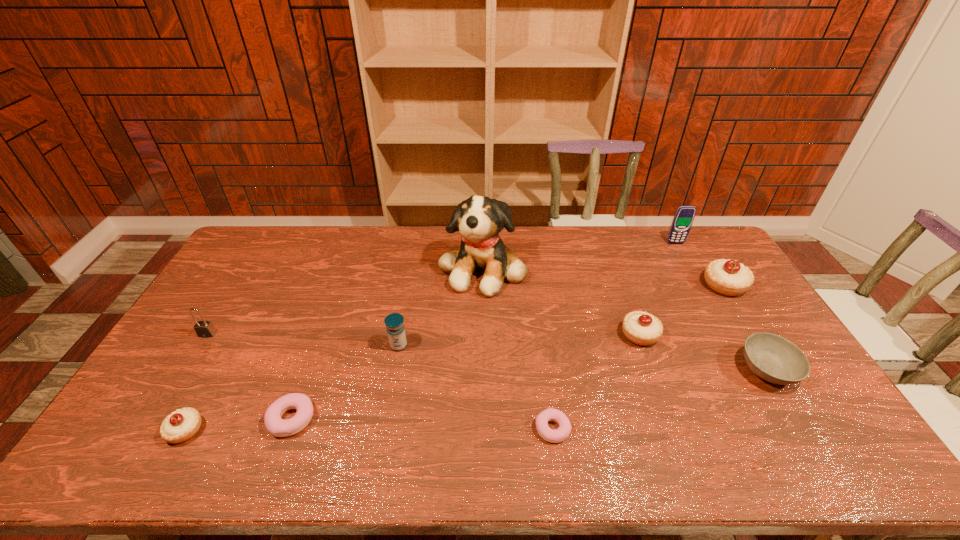
Find the location of a particular element. The image size is (960, 540). vacant region located 0.150m on the shackle of the gray padlock is located at coordinates (180, 379).

Find the location of `vacant space located 0.280m on the left of the blue medicine`. vacant space located 0.280m on the left of the blue medicine is located at coordinates (296, 346).

Identify the location of free point located on the front of the fourth object from right to left. This screenshot has height=540, width=960. (663, 399).

Locate an element on the screen. Image resolution: width=960 pixels, height=540 pixels. vacant area situated 0.120m on the left of the bowl is located at coordinates [696, 370].

Where is `free space located on the right of the leftmost beige pastry`? free space located on the right of the leftmost beige pastry is located at coordinates (223, 430).

This screenshot has height=540, width=960. I want to click on vacant point located on the right of the third object from left to right, so click(463, 419).

The height and width of the screenshot is (540, 960). What are the coordinates of `vacant space positioned on the left of the shortest pastry` in the screenshot? It's located at (389, 429).

Where is `puppy that is at the far edge`? The height and width of the screenshot is (540, 960). puppy that is at the far edge is located at coordinates (480, 219).

The height and width of the screenshot is (540, 960). Identify the location of cellular telephone positioned at the far edge. (684, 216).

What are the coordinates of `padlock located at the left edge` in the screenshot? It's located at (205, 329).